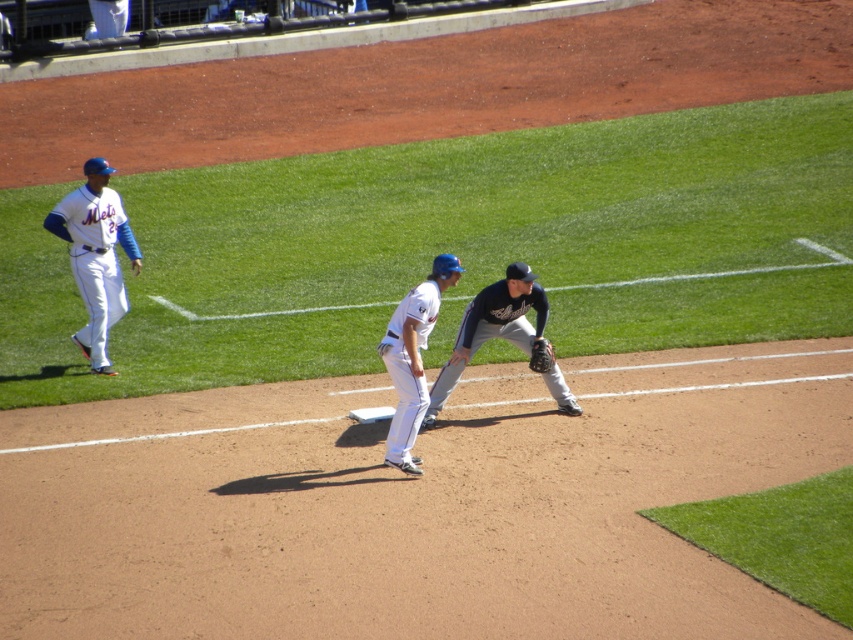
From the picture: Is dark gray uniform at center wider than white uniform at center?

Yes.

Does dark gray uniform at center have a larger size compared to white uniform at center?

Yes, dark gray uniform at center is bigger than white uniform at center.

Where is `dark gray uniform at center`? The height and width of the screenshot is (640, 853). dark gray uniform at center is located at coordinates (492, 326).

Consider the image. Which is more to the right, white uniformed player at left or dark brown leather glove at lower center?

Positioned to the right is dark brown leather glove at lower center.

This screenshot has height=640, width=853. I want to click on white uniformed player at left, so click(96, 257).

Does point (107, 272) come in front of point (544, 368)?

No, it is not.

At what (x,y) coordinates should I click in order to perform the action: click on white uniformed player at left. Please return your answer as a coordinate pair (x, y). Image resolution: width=853 pixels, height=640 pixels. Looking at the image, I should click on pos(96,257).

How much distance is there between white uniformed player at left and dark gray uniform at center?

white uniformed player at left and dark gray uniform at center are 3.46 meters apart.

Is point (96, 269) closer to camera compared to point (486, 333)?

No, (96, 269) is further to viewer.

Image resolution: width=853 pixels, height=640 pixels. Identify the location of white uniformed player at left. (96, 257).

The width and height of the screenshot is (853, 640). Identify the location of white uniformed player at left. pos(96,257).